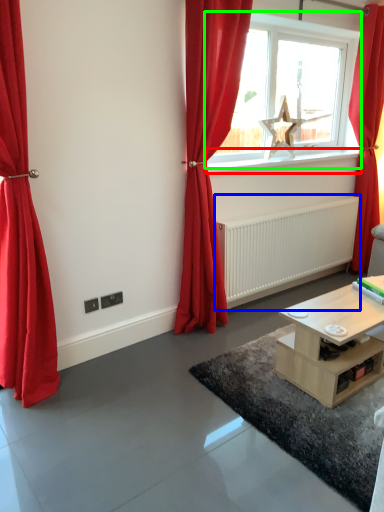
Question: Which is nearer to the window sill (highlighted by a red box)? radiator (highlighted by a blue box) or window (highlighted by a green box).

Choices:
 (A) radiator
 (B) window

Answer: (B)